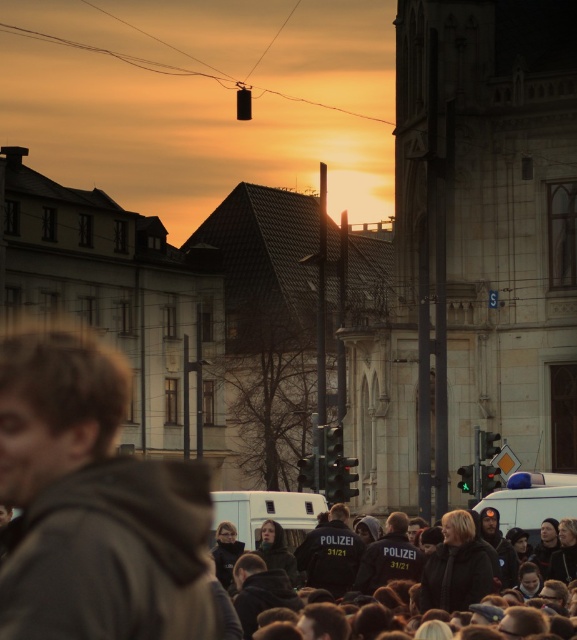
Does point (153, 636) lie behind point (524, 509)?

No, (153, 636) is in front of (524, 509).

Based on the photo, which is more to the left, dark brown hoodie at center or white plastic police van at lower right?

dark brown hoodie at center

In order to click on dark brown hoodie at center in this screenshot , I will do `click(92, 506)`.

Locate an element on the screen. The image size is (577, 640). dark brown hoodie at center is located at coordinates (92, 506).

Can you confirm if white matte police van at center is taller than white plastic police van at lower right?

Correct, white matte police van at center is much taller as white plastic police van at lower right.

Between white matte police van at center and white plastic police van at lower right, which one is positioned lower?

white matte police van at center is lower down.

Identify the location of white matte police van at center. Image resolution: width=577 pixels, height=640 pixels. (267, 513).

Which is below, black matte uniform at center or white matte police van at center?

white matte police van at center is lower down.

Who is positioned more to the right, black matte uniform at center or white matte police van at center?

Positioned to the right is black matte uniform at center.

Where is `black matte uniform at center`? The width and height of the screenshot is (577, 640). black matte uniform at center is located at coordinates (414, 579).

At what (x,y) coordinates should I click in order to perform the action: click on black matte uniform at center. Please return your answer as a coordinate pair (x, y). The image size is (577, 640). Looking at the image, I should click on (414, 579).